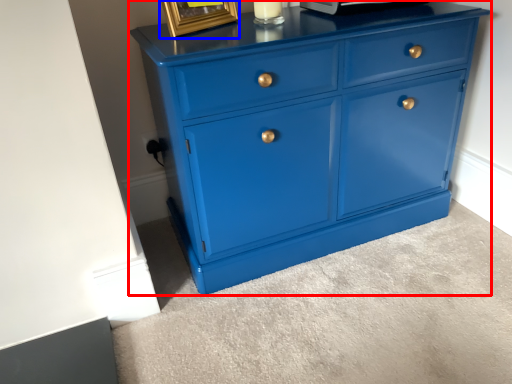
Question: Which object is closer to the camera taking this photo, chest of drawers (highlighted by a red box) or picture frame (highlighted by a blue box)?

Choices:
 (A) chest of drawers
 (B) picture frame

Answer: (A)